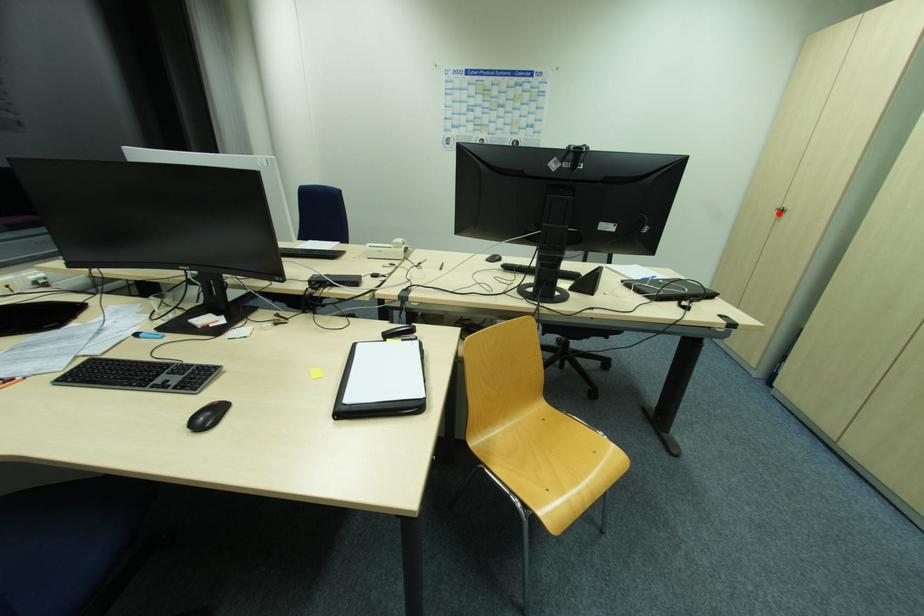
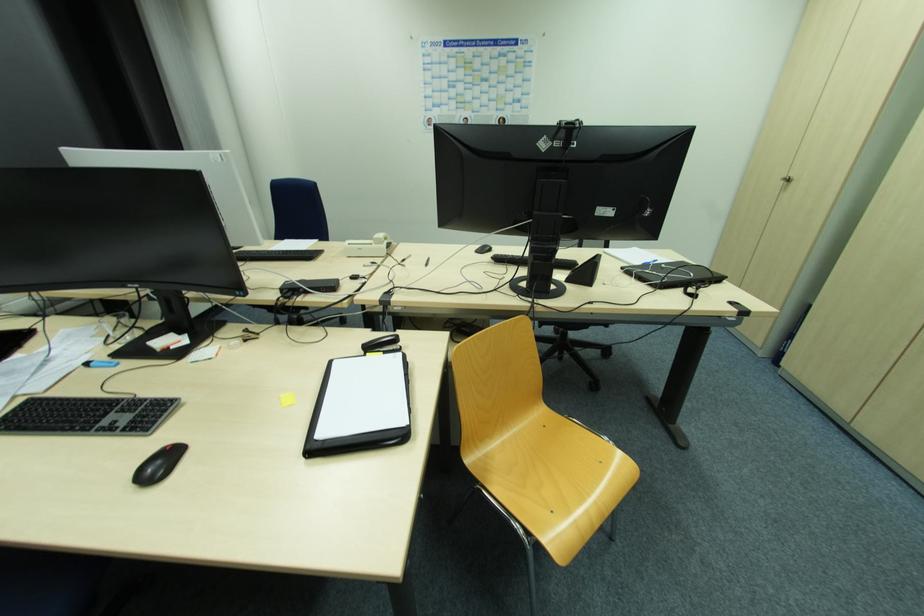
The point at the highlighted location is marked in the first image. Where is the corresponding point in the second image?

(784, 183)